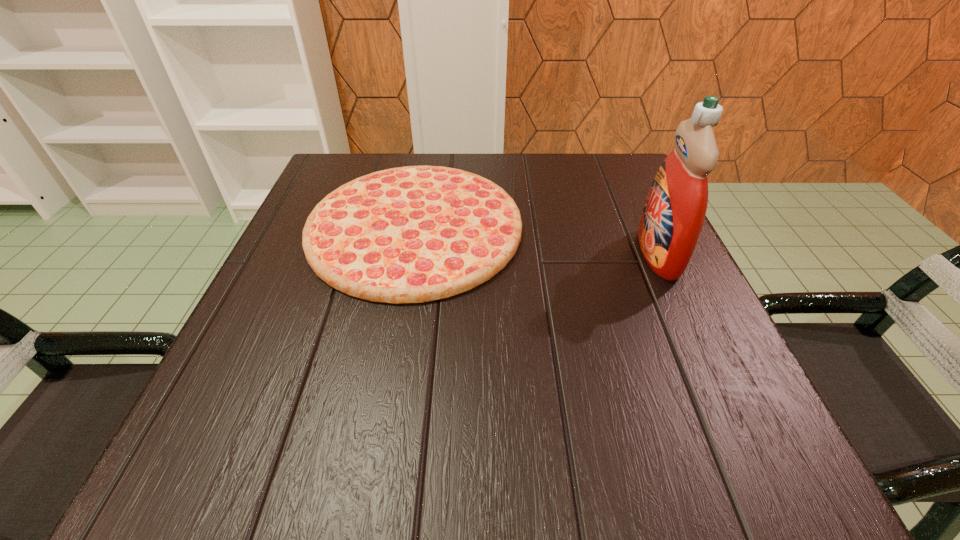
In order to click on object that is positioned at the right edge in this screenshot , I will do `click(674, 212)`.

At what (x,y) coordinates should I click in order to perform the action: click on object situated at the far left corner. Please return your answer as a coordinate pair (x, y). This screenshot has height=540, width=960. Looking at the image, I should click on (414, 234).

Locate an element on the screen. Image resolution: width=960 pixels, height=540 pixels. vacant area at the far edge of the desktop is located at coordinates (481, 157).

The image size is (960, 540). What are the coordinates of `vacant space at the near edge of the desktop` in the screenshot? It's located at [583, 427].

This screenshot has height=540, width=960. I want to click on free point at the right edge, so click(675, 300).

Where is `free space at the far left corner of the desktop`? Image resolution: width=960 pixels, height=540 pixels. free space at the far left corner of the desktop is located at coordinates (337, 173).

In the image, there is a desktop. Where is `free space at the near right corner`? The height and width of the screenshot is (540, 960). free space at the near right corner is located at coordinates (715, 457).